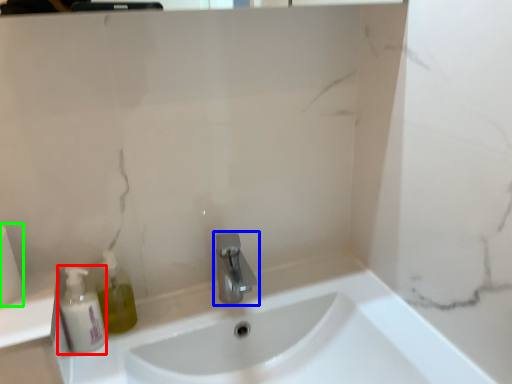
Question: Estimate the real-world distances between objects in this image. Which object is farther from mouthwash (highlighted by a red box), tap (highlighted by a blue box) or toilet paper (highlighted by a green box)?

Choices:
 (A) tap
 (B) toilet paper

Answer: (A)